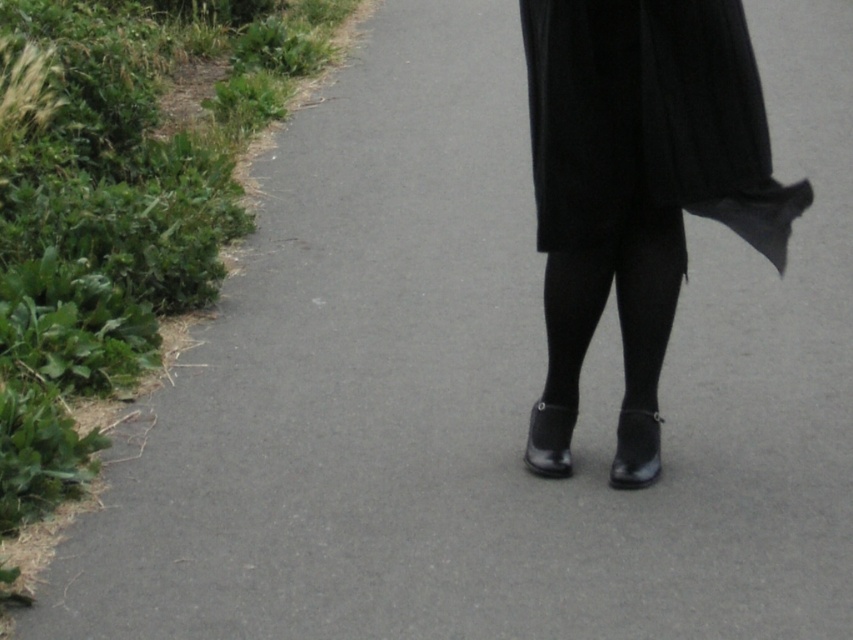
Question: Is black matte skirt at center thinner than black tights at center?

Choices:
 (A) yes
 (B) no

Answer: (B)

Question: Which object appears farthest from the camera in this image?

Choices:
 (A) black tights at center
 (B) black matte skirt at center

Answer: (A)

Question: Which point is closer to the camera?

Choices:
 (A) (587, 42)
 (B) (599, 288)

Answer: (A)

Question: From the image, what is the correct spatial relationship of black matte skirt at center in relation to black tights at center?

Choices:
 (A) above
 (B) below

Answer: (A)

Question: Does black matte skirt at center come behind black tights at center?

Choices:
 (A) yes
 (B) no

Answer: (B)